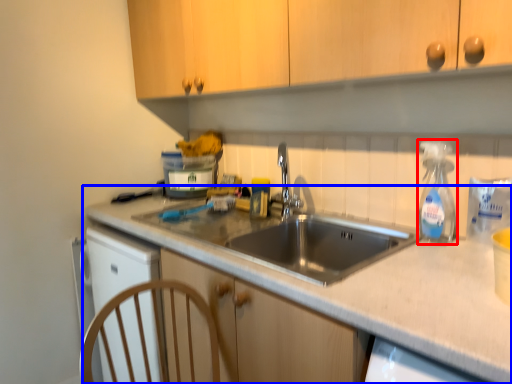
Question: Which object appears closest to the camera in this image, soap dispenser (highlighted by a red box) or countertop (highlighted by a blue box)?

Choices:
 (A) soap dispenser
 (B) countertop

Answer: (B)